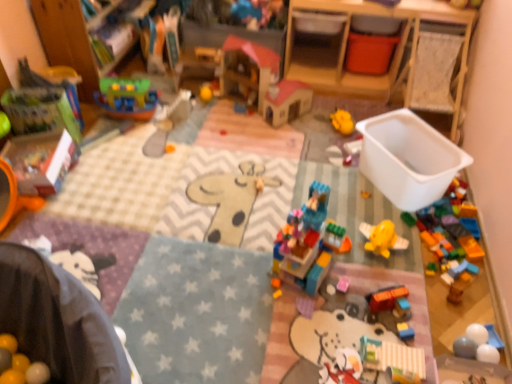
Find the location of a particular element. vacant space that is in between orange matte car at center, the 2th toy from the bottom, and yellow matte ball at center, acting as the 3th toy starting from the top is located at coordinates (272, 174).